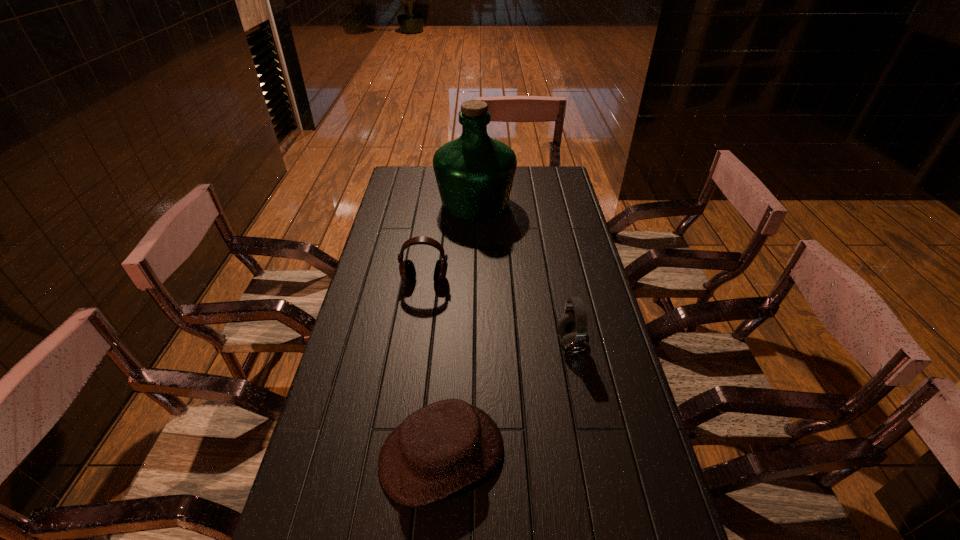
I want to click on vacant area that lies between the hat and the right headset, so click(x=507, y=399).

Identify the location of vacant area between the left headset and the right headset. (498, 312).

Locate an element on the screen. Image resolution: width=960 pixels, height=540 pixels. blank region between the tallest object and the left headset is located at coordinates (450, 241).

Where is `free space between the right headset and the third nearest object`? free space between the right headset and the third nearest object is located at coordinates (498, 312).

Locate which object ranks in proximity to the left headset. Please provide its 2D coordinates. Your answer should be formatted as a tuple, i.e. [(x, y)], where the tuple contains the x and y coordinates of a point satisfying the conditions above.

[(474, 173)]

Locate which object ranks in proximity to the liquor. Please provide its 2D coordinates. Your answer should be formatted as a tuple, i.e. [(x, y)], where the tuple contains the x and y coordinates of a point satisfying the conditions above.

[(407, 271)]

Locate an element on the screen. Image resolution: width=960 pixels, height=540 pixels. vacant point that satisfies the following two spatial constraints: 1. on the label side of the liquor; 2. on the ear pads of the second farthest object is located at coordinates (474, 280).

Where is `vacant region that satisfies the following two spatial constraints: 1. on the label side of the tallest object; 2. on the ear pads of the farther headset`? This screenshot has height=540, width=960. vacant region that satisfies the following two spatial constraints: 1. on the label side of the tallest object; 2. on the ear pads of the farther headset is located at coordinates (474, 280).

Where is `free space that satisfies the following two spatial constraints: 1. on the label side of the farthest object; 2. on the ear pads of the second farthest object`? This screenshot has width=960, height=540. free space that satisfies the following two spatial constraints: 1. on the label side of the farthest object; 2. on the ear pads of the second farthest object is located at coordinates (474, 280).